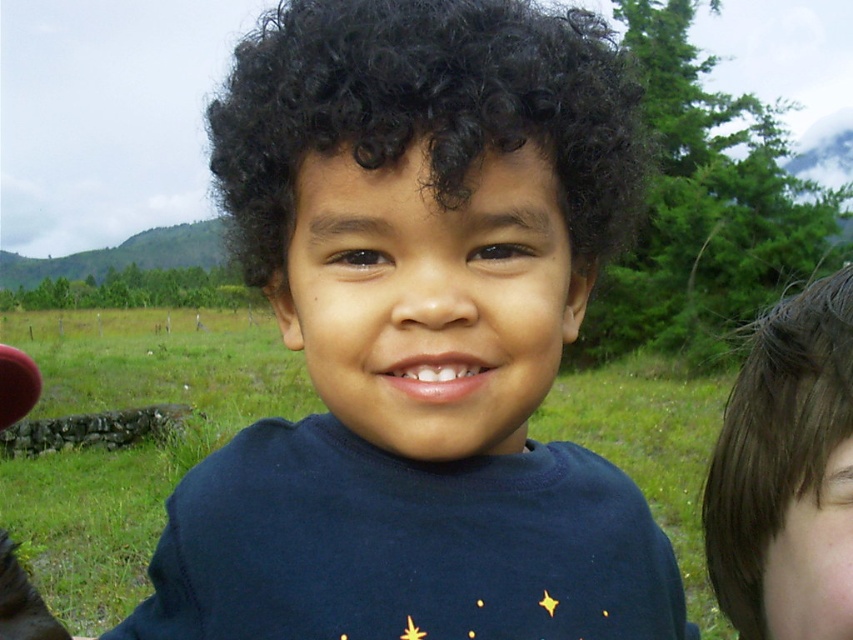
You are a photographer trying to capture the dark blue t shirt at center in a photo. You want to ensure that the dark blue t shirt at center is centered precisely in the frame. Given that the camera is positioned to focus on point (418, 339), will the dark blue t shirt at center be centered in the photo?

Yes, the dark blue t shirt at center is located exactly at point (418, 339), so positioning the camera to focus on that point will center the dark blue t shirt at center in the frame.